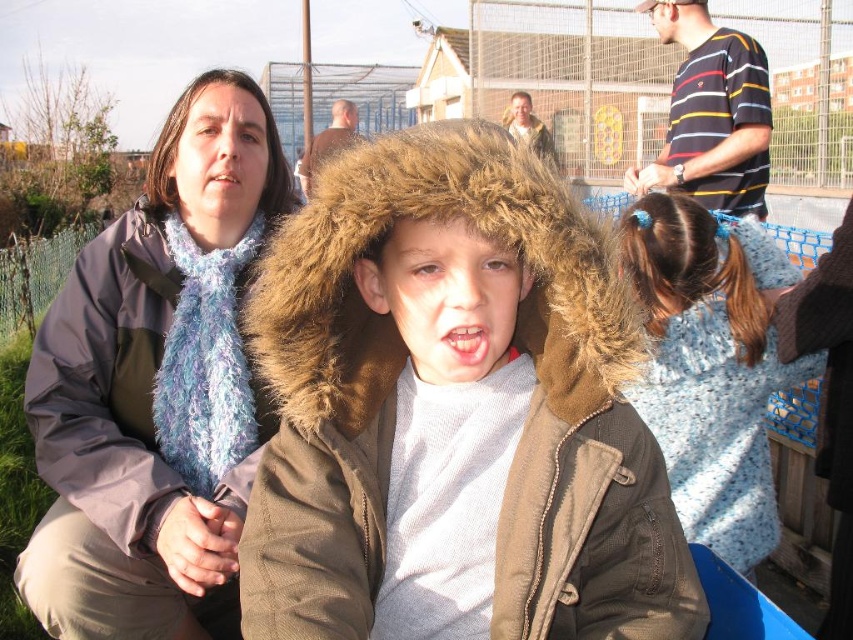
Question: Does blue fuzzy scarf at left appear over striped cotton shirt at upper right?

Choices:
 (A) yes
 (B) no

Answer: (B)

Question: Estimate the real-world distances between objects in this image. Which object is farther from the blue knitted sweater at right?

Choices:
 (A) brown corduroy jacket at center
 (B) striped cotton shirt at upper right

Answer: (B)

Question: Which object is positioned closest to the brown corduroy jacket at center?

Choices:
 (A) striped cotton shirt at upper right
 (B) blue fuzzy scarf at left
 (C) blue knitted sweater at right

Answer: (B)

Question: Does blue fuzzy scarf at left have a greater width compared to striped cotton shirt at upper right?

Choices:
 (A) yes
 (B) no

Answer: (A)

Question: Does brown corduroy jacket at center have a larger size compared to blue knitted sweater at right?

Choices:
 (A) no
 (B) yes

Answer: (A)

Question: Considering the real-world distances, which object is farthest from the brown corduroy jacket at center?

Choices:
 (A) striped cotton shirt at upper right
 (B) blue fuzzy scarf at left
 (C) blue knitted sweater at right

Answer: (A)